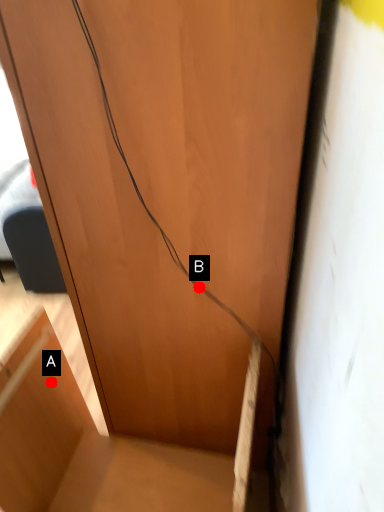
Question: Two points are circled on the image, labeled by A and B beside each circle. Which point is closer to the camera?

Choices:
 (A) A is closer
 (B) B is closer

Answer: (B)